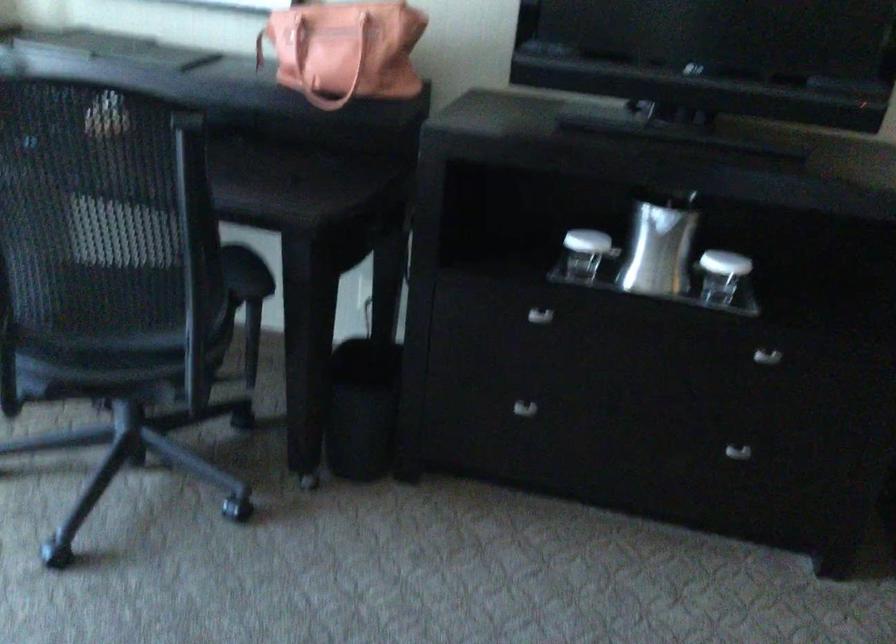
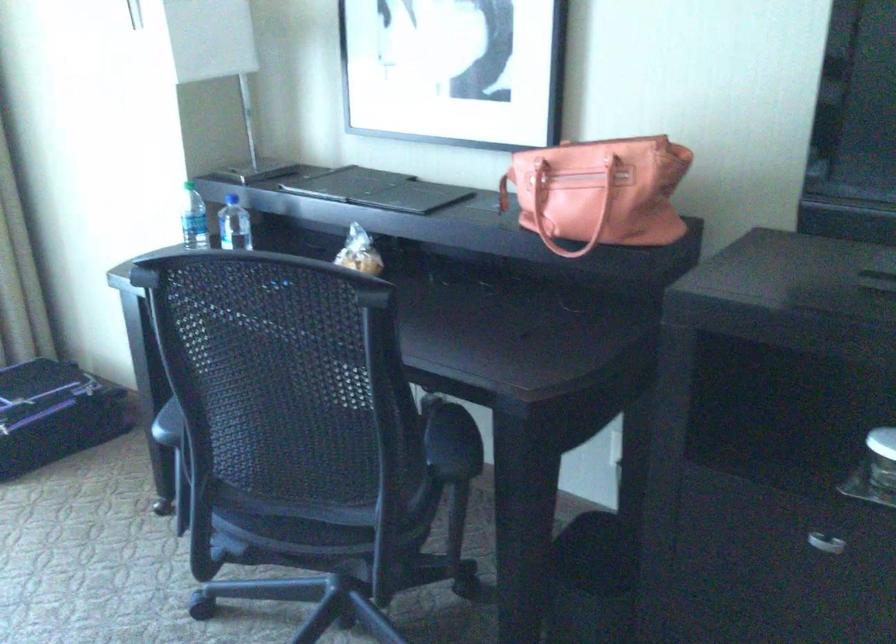
Question: The camera is either moving clockwise (left) or counter-clockwise (right) around the object. The first image is from the beginning of the video and the second image is from the end. Is the camera moving left or right when shooting the video?

Choices:
 (A) Left
 (B) Right

Answer: (B)